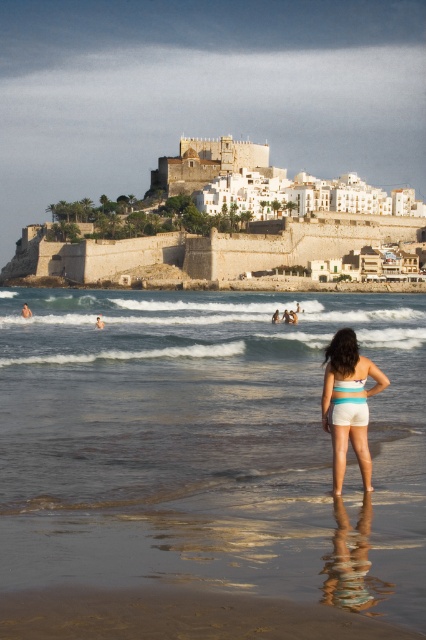
You are a lifeguard on duty and need to ensure swimmer safety. The swimmer is wearing the blue striped shorts at center and the multicolored fabric bikini top at center. According to the safety guidelines, swimwear pieces must not be more than 1.5 meters apart to avoid separation in rough waters. Is this swimmer compliant with the safety rule?

The blue striped shorts at center and multicolored fabric bikini top at center are 1.41 meters apart from each other, which is within the 1.5 meters safety guideline. Therefore, the swimmer is compliant with the safety rule.

You are a photographer taking a picture of the beach scene. You notice the blue striped shorts at center and the multicolored fabric bikini top at center in your frame. Which object should you adjust your focus on if you want to ensure the closer one is sharp?

You should focus on the blue striped shorts at center because it is closer to the viewer than the multicolored fabric bikini top at center.